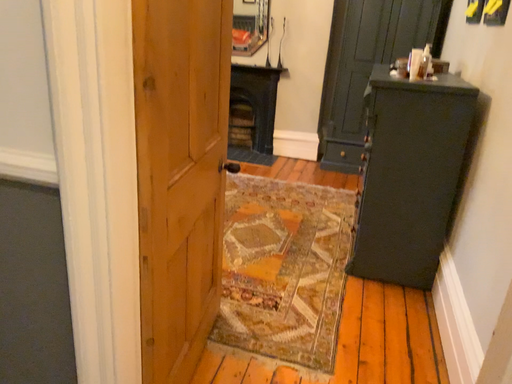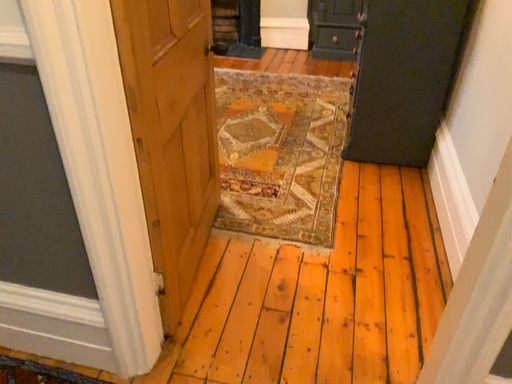
Question: Which way did the camera rotate in the video?

Choices:
 (A) rotated downward
 (B) rotated upward

Answer: (A)